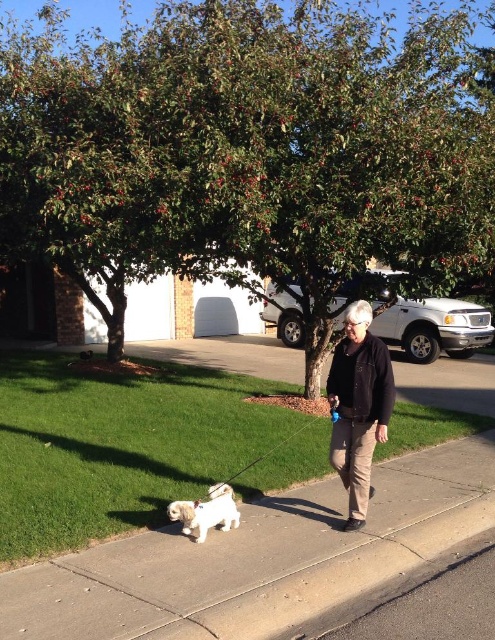
You are a pedestrian walking on the sidewalk and see the green leafy tree at upper center and the black matte jacket at center. Which object is located to the right of the other?

The green leafy tree at upper center is positioned on the left side of black matte jacket at center, so the black matte jacket at center is to the right of the green leafy tree at upper center.